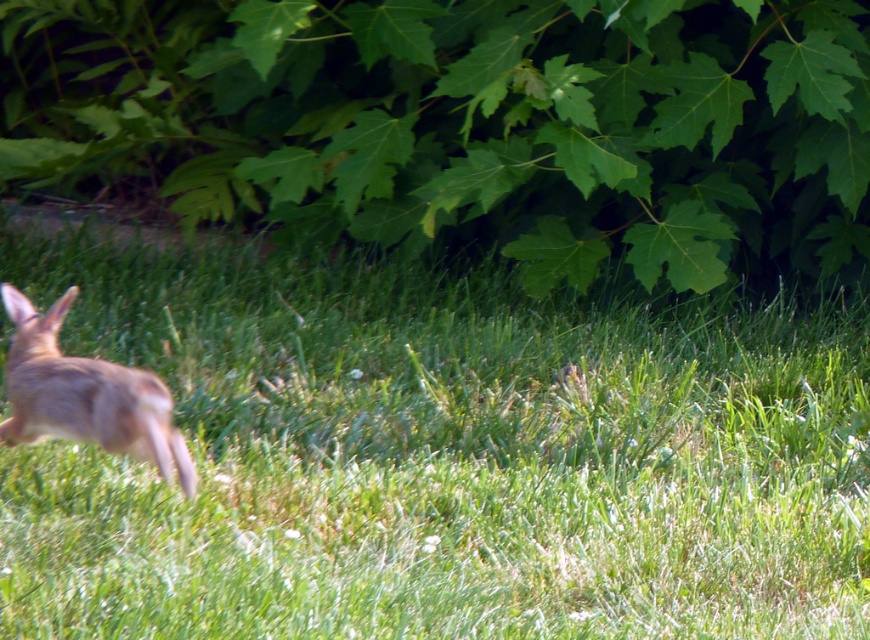
You are a photographer trying to capture the furry brown rabbit at left while ensuring the green grassy at center is in the background. Can you focus on the rabbit and still have the grass visible in the background?

The green grassy at center is closer to the viewer than the furry brown rabbit at left, so focusing on the rabbit would place the grass in front of it, making it difficult to have the grass as a background. Adjust your position to ensure the grass is behind the rabbit for the desired effect.